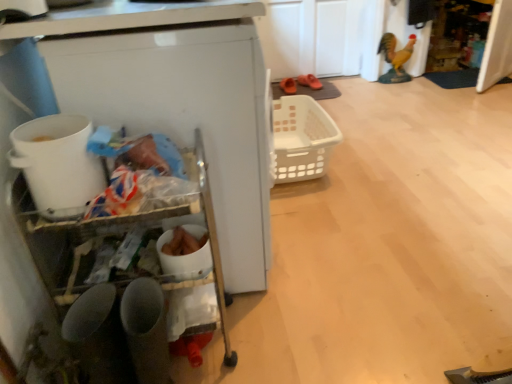
Find the location of `white plastic bucket at left`. white plastic bucket at left is located at coordinates (57, 164).

Measure the distance between shiny gold statue at upper right and camera.

They are 3.06 meters apart.

You are a GUI agent. You are given a task and a screenshot of the screen. Output one action in this format:
    pyautogui.click(x=<x>, y=<y>)
    Task: Click on the orange suede shoes at center, which is counted as the first footwear, starting from the left
    
    Given the screenshot: What is the action you would take?
    pyautogui.click(x=288, y=86)

From the image's perspective, which is above, orange suede shoes at center, which ranks as the second footwear in right-to-left order, or white plastic bucket at left?

orange suede shoes at center, which ranks as the second footwear in right-to-left order, appears higher in the image.

From a real-world perspective, is orange suede shoes at center, which ranks as the second footwear in right-to-left order, under white plastic bucket at left?

Yes.

In terms of size, does orange suede shoes at center, which is counted as the first footwear, starting from the left, appear bigger or smaller than white plastic bucket at left?

Clearly, orange suede shoes at center, which is counted as the first footwear, starting from the left, is smaller in size than white plastic bucket at left.

Is orange suede shoes at center, which is counted as the first footwear, starting from the left, not near white plastic basket at center?

That's not correct — orange suede shoes at center, which is counted as the first footwear, starting from the left, is a little close to white plastic basket at center.

Is orange suede shoes at center, which is counted as the first footwear, starting from the left, to the right of white plastic basket at center from the viewer's perspective?

Yes.

Is orange suede shoes at center, which ranks as the second footwear in right-to-left order, facing towards white plastic basket at center?

Yes, orange suede shoes at center, which ranks as the second footwear in right-to-left order, is aimed at white plastic basket at center.

Considering the sizes of objects orange suede shoes at center, which ranks as the second footwear in right-to-left order, and white plastic basket at center in the image provided, who is taller, orange suede shoes at center, which ranks as the second footwear in right-to-left order, or white plastic basket at center?

Standing taller between the two is white plastic basket at center.

Is white plastic bucket at left directly adjacent to white plastic basket at center?

No, white plastic bucket at left is not beside white plastic basket at center.

Is white plastic bucket at left oriented towards white plastic basket at center?

No.

Is white plastic bucket at left spatially inside white plastic basket at center, or outside of it?

white plastic bucket at left is not inside white plastic basket at center, it's outside.

Is white plastic bucket at left bigger than white plastic basket at center?

Incorrect, white plastic bucket at left is not larger than white plastic basket at center.

The image size is (512, 384). Find the location of `the 2nd footwear below the white plastic bucket at left (from a real-world perspective)`. the 2nd footwear below the white plastic bucket at left (from a real-world perspective) is located at coordinates pyautogui.click(x=310, y=81).

How many degrees apart are the facing directions of orange rubber clogs at center, the 2th footwear positioned from the left, and white plastic bucket at left?

There is a 78.9-degree angle between the facing directions of orange rubber clogs at center, the 2th footwear positioned from the left, and white plastic bucket at left.

Is orange rubber clogs at center, which is the first footwear from right to left, positioned beyond the bounds of white plastic bucket at left?

Indeed, orange rubber clogs at center, which is the first footwear from right to left, is completely outside white plastic bucket at left.

Relative to white plastic bucket at left, is orange rubber clogs at center, the 2th footwear positioned from the left, in front or behind?

Answer: Clearly, orange rubber clogs at center, the 2th footwear positioned from the left, is behind white plastic bucket at left.

Is shiny gold statue at upper right taller than white plastic bucket at left?

Yes.

In the scene shown: Who is smaller, shiny gold statue at upper right or white plastic bucket at left?

white plastic bucket at left is smaller.

Who is more distant, shiny gold statue at upper right or white plastic bucket at left?

shiny gold statue at upper right.

At what (x,y) coordinates should I click in order to perform the action: click on appliance on the left of shiny gold statue at upper right. Please return your answer as a coordinate pair (x, y). The width and height of the screenshot is (512, 384). Looking at the image, I should click on (57, 164).

How different are the orientations of orange rubber clogs at center, the 2th footwear positioned from the left, and white plastic basket at center in degrees?

orange rubber clogs at center, the 2th footwear positioned from the left, and white plastic basket at center are facing 78.9 degrees away from each other.

Is orange rubber clogs at center, which is the first footwear from right to left, far away from white plastic basket at center?

Yes.

Does orange rubber clogs at center, the 2th footwear positioned from the left, have a greater width compared to white plastic basket at center?

No.

The width and height of the screenshot is (512, 384). In order to click on basket below the shiny gold statue at upper right (from the image's perspective) in this screenshot , I will do `click(302, 138)`.

Considering the positions of points (410, 43) and (290, 107), is point (410, 43) farther from camera compared to point (290, 107)?

Yes, it is behind point (290, 107).

Is shiny gold statue at upper right not inside white plastic basket at center?

shiny gold statue at upper right lies outside white plastic basket at center's area.

Between shiny gold statue at upper right and white plastic basket at center, which one has smaller size?

Smaller between the two is shiny gold statue at upper right.

I want to click on the 1st footwear to the right of the white plastic bucket at left, starting your count from the anchor, so click(288, 86).

At what (x,y) coordinates should I click in order to perform the action: click on footwear that is the 1st one when counting backward from the white plastic basket at center. Please return your answer as a coordinate pair (x, y). Looking at the image, I should click on (288, 86).

Which object lies nearer to the anchor point white plastic basket at center, orange suede shoes at center, which ranks as the second footwear in right-to-left order, or white plastic bucket at left?

orange suede shoes at center, which ranks as the second footwear in right-to-left order, is closer to white plastic basket at center.

In the scene shown: Which object lies nearer to the anchor point orange suede shoes at center, which ranks as the second footwear in right-to-left order, white plastic bucket at left or orange rubber clogs at center, which is the first footwear from right to left?

orange rubber clogs at center, which is the first footwear from right to left.

Which object lies nearer to the anchor point shiny gold statue at upper right, white plastic basket at center or white plastic bucket at left?

white plastic basket at center.

Considering their positions, is white plastic bucket at left positioned closer to white plastic basket at center than orange rubber clogs at center, which is the first footwear from right to left?

orange rubber clogs at center, which is the first footwear from right to left, lies closer to white plastic basket at center than the other object.

When comparing their distances from orange rubber clogs at center, which is the first footwear from right to left, does orange suede shoes at center, which is counted as the first footwear, starting from the left, or white plastic basket at center seem further?

The object further to orange rubber clogs at center, which is the first footwear from right to left, is white plastic basket at center.

Which object lies nearer to the anchor point shiny gold statue at upper right, orange suede shoes at center, which is counted as the first footwear, starting from the left, or orange rubber clogs at center, the 2th footwear positioned from the left?

orange rubber clogs at center, the 2th footwear positioned from the left, is positioned closer to the anchor shiny gold statue at upper right.

From the image, which object appears to be farther from shiny gold statue at upper right, orange suede shoes at center, which ranks as the second footwear in right-to-left order, or white plastic bucket at left?

white plastic bucket at left lies further to shiny gold statue at upper right than the other object.

Which object lies further to the anchor point orange suede shoes at center, which is counted as the first footwear, starting from the left, shiny gold statue at upper right or white plastic bucket at left?

Among the two, white plastic bucket at left is located further to orange suede shoes at center, which is counted as the first footwear, starting from the left.

Locate an element on the screen. The image size is (512, 384). toy positioned between white plastic basket at center and orange suede shoes at center, which ranks as the second footwear in right-to-left order, from near to far is located at coordinates (395, 58).

I want to click on footwear located between white plastic bucket at left and orange rubber clogs at center, which is the first footwear from right to left, in the depth direction, so click(288, 86).

Where is `basket between white plastic bucket at left and shiny gold statue at upper right from front to back`? Image resolution: width=512 pixels, height=384 pixels. basket between white plastic bucket at left and shiny gold statue at upper right from front to back is located at coordinates (302, 138).

The image size is (512, 384). I want to click on basket located between white plastic bucket at left and orange rubber clogs at center, the 2th footwear positioned from the left, in the depth direction, so click(302, 138).